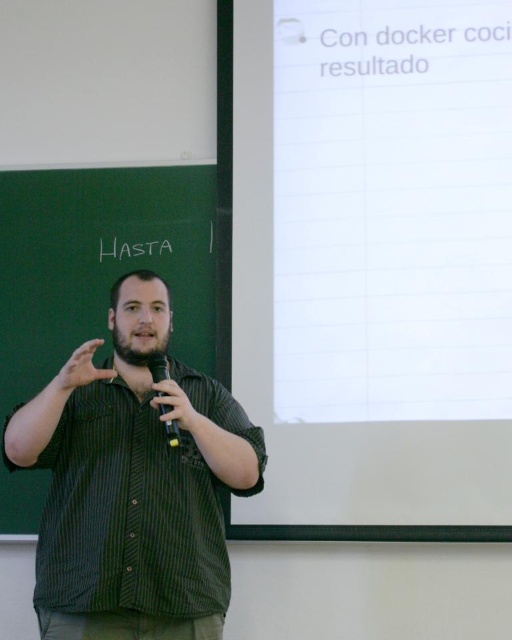
Question: Is green striped shirt at center positioned in front of green chalkboard at left?

Choices:
 (A) yes
 (B) no

Answer: (A)

Question: Can you confirm if green striped shirt at center is positioned above matte black hand at center?

Choices:
 (A) yes
 (B) no

Answer: (B)

Question: Which of the following is the closest to the observer?

Choices:
 (A) black plastic microphone at center
 (B) matte black hand at center

Answer: (B)

Question: Which of the following is the farthest from the observer?

Choices:
 (A) matte black hand at center
 (B) black plastic microphone at center

Answer: (B)

Question: From the image, what is the correct spatial relationship of green striped shirt at center in relation to matte black hand at center?

Choices:
 (A) below
 (B) above

Answer: (A)

Question: Which is farther from the green chalkboard at left?

Choices:
 (A) green striped shirt at center
 (B) black plastic microphone at center

Answer: (B)